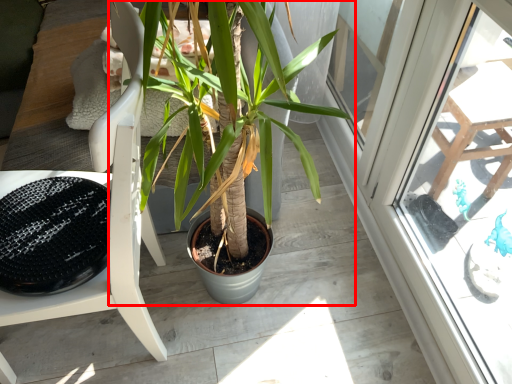
Question: Considering the relative positions of houseplant (annotated by the red box) and chair in the image provided, where is houseplant (annotated by the red box) located with respect to the staircase?

Choices:
 (A) right
 (B) left

Answer: (B)